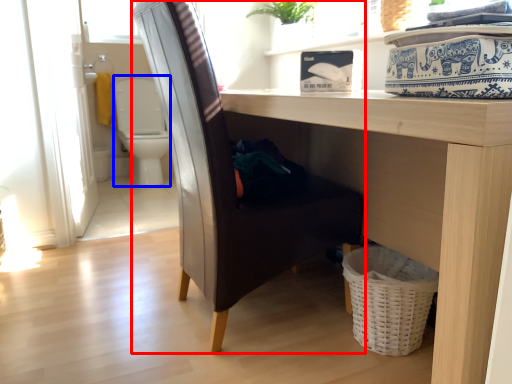
Question: Among these objects, which one is farthest to the camera, chair (highlighted by a red box) or swivel chair (highlighted by a blue box)?

Choices:
 (A) chair
 (B) swivel chair

Answer: (B)